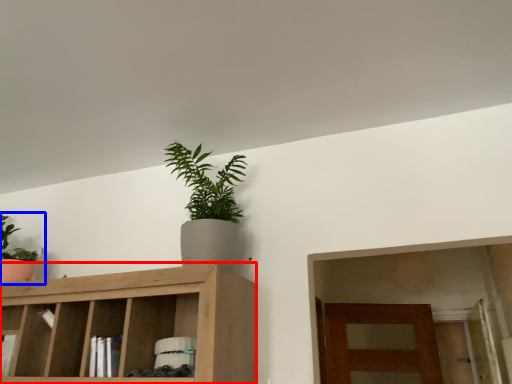
Question: Which point is closer to the camera, cabinetry (highlighted by a red box) or houseplant (highlighted by a blue box)?

Choices:
 (A) cabinetry
 (B) houseplant

Answer: (A)